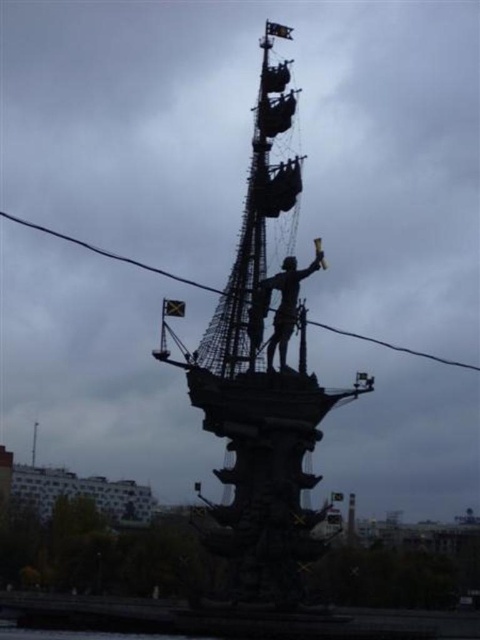
You are an architect designing a new park layout. You need to place a new sculpture that is 3 meters tall. The park already has the black matte ship at center and the silhouette bronze statue at center. Considering their sizes, which existing object should the new sculpture be placed closer to to maintain visual balance?

The new sculpture should be placed closer to the silhouette bronze statue at center because the black matte ship at center is larger in size than the silhouette bronze statue at center, so balancing with a smaller object would help maintain visual harmony.

You are standing at the base of the monument and want to take a photo of the point at coordinates point (320,246). If your camera has a maximum focus range of 150 meters, will you be able to focus on that point?

The distance of point (320,246) from the viewer is 168.39 meters, which exceeds the camera maximum focus range of 150 meters. Therefore, the camera will not be able to focus on that point.

You are standing in front of the monument and want to take a photo of the silhouette bronze statue at center. Where should you position yourself to capture the statue in the center of your camera frame?

You should position yourself directly in front of the silhouette bronze statue at center at point coordinates approximately 0.478 on the x axis and 0.583 on the y axis to center it in your camera frame.